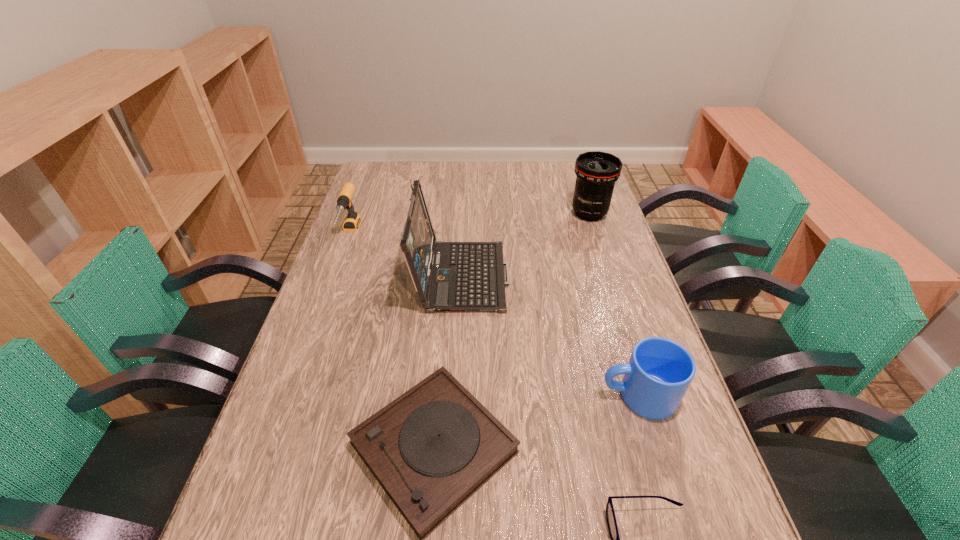
Locate an element on the screen. The width and height of the screenshot is (960, 540). the tallest object is located at coordinates (449, 276).

You are a GUI agent. You are given a task and a screenshot of the screen. Output one action in this format:
    pyautogui.click(x=<x>, y=<y>)
    Task: Click on the second tallest object
    The width and height of the screenshot is (960, 540).
    Given the screenshot: What is the action you would take?
    pyautogui.click(x=596, y=171)

Find the location of a particular element. The image size is (960, 540). the leftmost object is located at coordinates (352, 221).

Identify the location of mug. (659, 372).

Locate an element on the screen. free location located on the front-facing side of the laptop computer is located at coordinates (x=612, y=273).

Locate an element on the screen. vacant space located on the left of the fifth shortest object is located at coordinates (549, 214).

Image resolution: width=960 pixels, height=540 pixels. Identify the location of blank space located 0.390m on the handle side of the leftmost object. 304,355.

Locate an element on the screen. The height and width of the screenshot is (540, 960). free space located on the side of the mug with the handle is located at coordinates (430, 395).

This screenshot has width=960, height=540. Identify the location of free space located on the side of the mug with the handle. (517, 395).

This screenshot has width=960, height=540. What are the coordinates of `vacant space located on the side of the mug with the handle` in the screenshot? It's located at (509, 395).